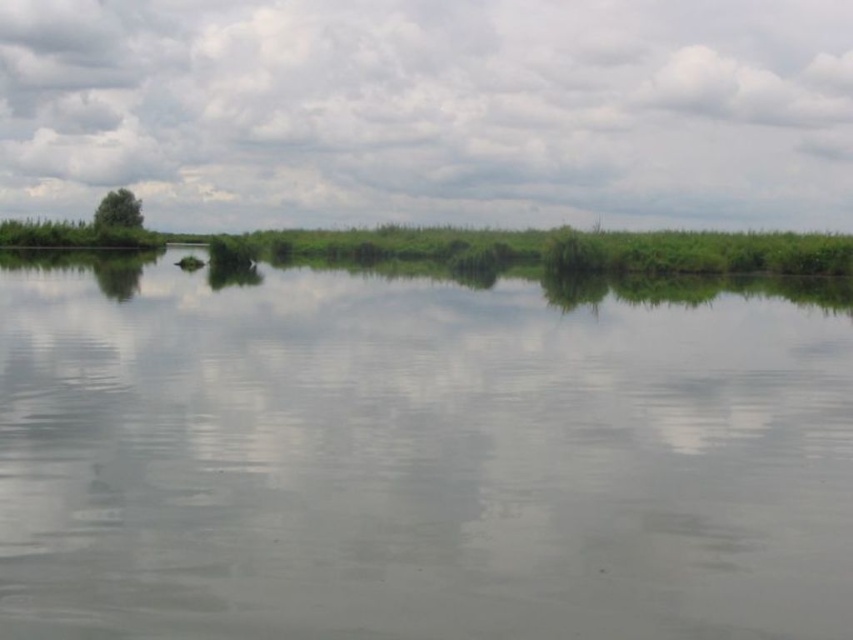
Is point (717, 440) closer to camera compared to point (115, 202)?

Yes, it is in front of point (115, 202).

Which is behind, point (554, 586) or point (102, 211)?

Point (102, 211)

I want to click on green grassy river at center, so click(421, 452).

Can you confirm if white fluffy cloud at upper center is positioned below green leafy tree at upper left?

No.

Does white fluffy cloud at upper center have a lesser height compared to green leafy tree at upper left?

No.

Between point (189, 108) and point (132, 196), which one is positioned in front?

Point (132, 196) is more forward.

The image size is (853, 640). What are the coordinates of `white fluffy cloud at upper center` in the screenshot? It's located at (430, 112).

Who is higher up, green grassy river at center or white fluffy cloud at upper center?

Positioned higher is white fluffy cloud at upper center.

The image size is (853, 640). Find the location of `green grassy river at center`. green grassy river at center is located at coordinates (421, 452).